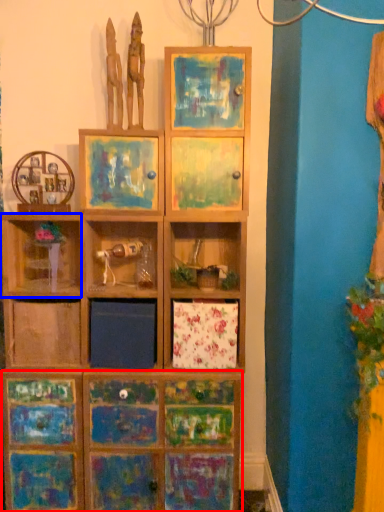
Question: Which point is closer to the camera, cabinetry (highlighted by a red box) or shelf (highlighted by a blue box)?

Choices:
 (A) cabinetry
 (B) shelf

Answer: (B)